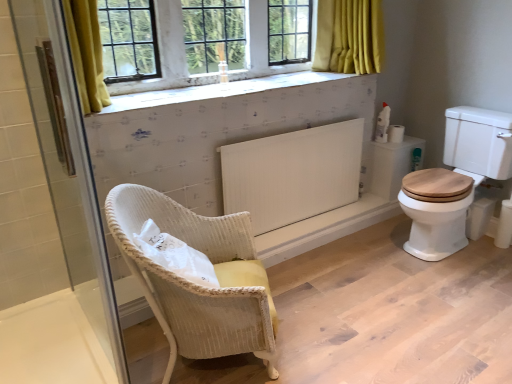
Image resolution: width=512 pixels, height=384 pixels. Find the location of `unoccupied area in front of white wicker rocking chair at right`. unoccupied area in front of white wicker rocking chair at right is located at coordinates (459, 289).